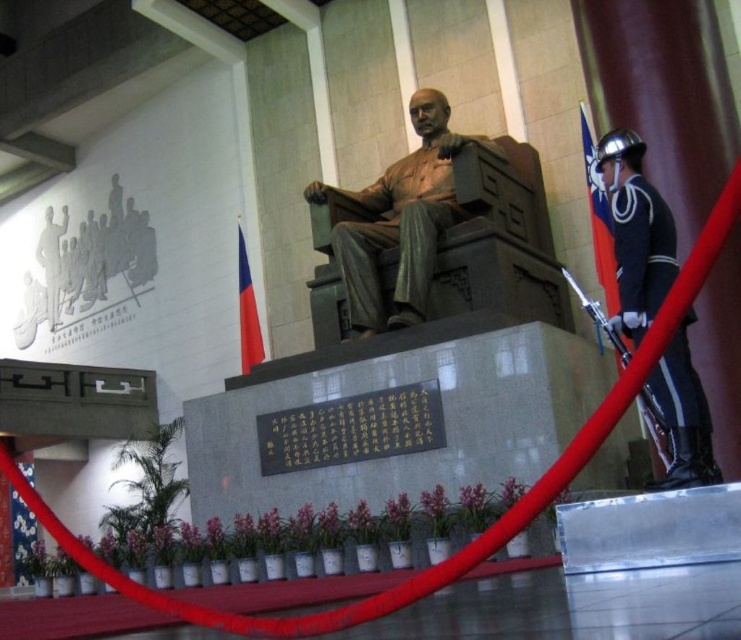
You are standing in the historical building and want to take a photo of the statue. You notice two points marked on the floor at coordinates point (416,301) and point (631,285). Which point is closer to the statue?

Point (631,285) is closer to the statue because point (416,301) is behind it according to their spatial relationship.

You are a visitor at this historical site and want to take a photo of both the shiny blue uniform at center and the shiny blue uniform at right. What is the minimum distance you need to move backward to include both in your photo frame?

The minimum distance you need to move backward to include both the shiny blue uniform at center and the shiny blue uniform at right is determined by the distance between them, which is 7.19 meters. To capture both in the frame, you should position yourself at least 7.19 meters away from the closer uniform.